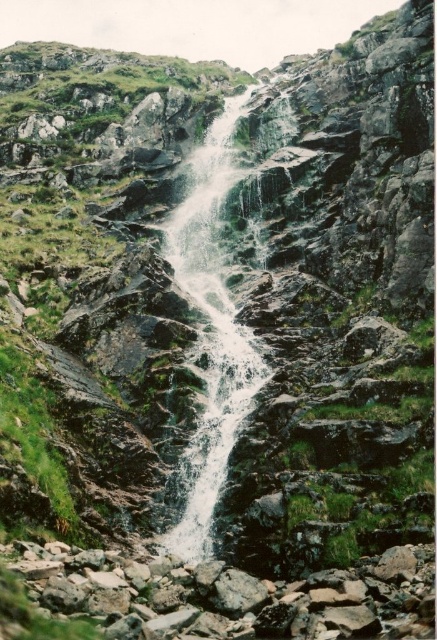
Consider the image. Which of these two, rocky boulder at center or white frothy water at center, stands taller?

white frothy water at center is taller.

From the picture: Who is positioned more to the left, rocky boulder at center or white frothy water at center?

white frothy water at center is more to the left.

In order to click on rocky boulder at center in this screenshot , I will do `click(212, 596)`.

Find the location of a particular element. rocky boulder at center is located at coordinates (212, 596).